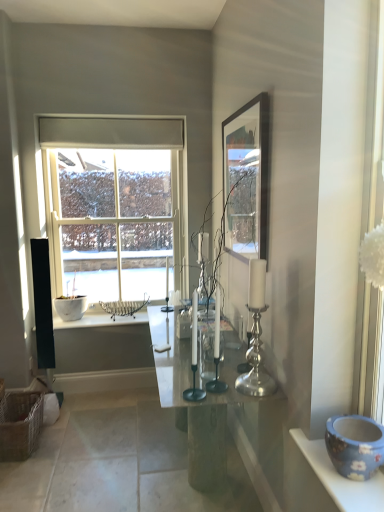
The image size is (384, 512). I want to click on vacant space underneath polished glass table at center (from a real-world perspective), so click(186, 468).